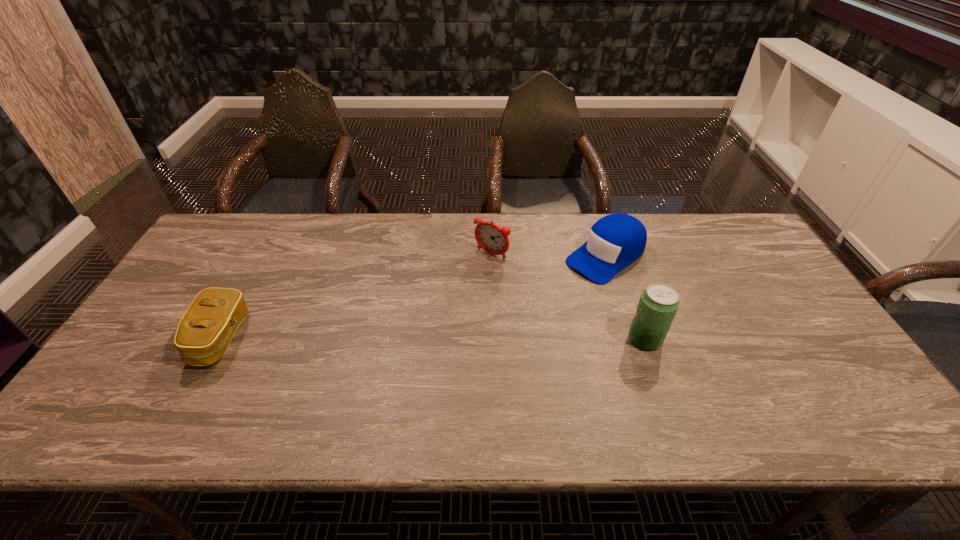
What are the coordinates of `vacant space that is in between the second object from left to right and the baseball cap` in the screenshot? It's located at (548, 255).

The width and height of the screenshot is (960, 540). What are the coordinates of `unoccupied area between the clutch bag and the baseball cap` in the screenshot? It's located at (413, 298).

Locate an element on the screen. free space between the soda and the clutch bag is located at coordinates (433, 339).

Where is `the second closest object to the tallest object`? the second closest object to the tallest object is located at coordinates (493, 239).

In order to click on the second closest object to the leftmost object in this screenshot , I will do `click(615, 241)`.

Identify the location of vacant area that satisfies the following two spatial constraints: 1. on the front side of the alarm clock; 2. on the right side of the baseball cap. The height and width of the screenshot is (540, 960). (492, 257).

Identify the location of free space that satisfies the following two spatial constraints: 1. on the front side of the alarm clock; 2. on the right side of the baseball cap. (492, 257).